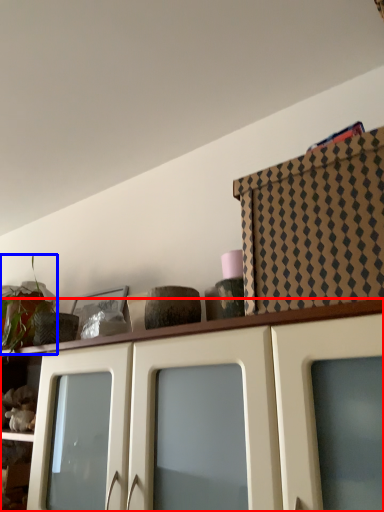
Question: Among these objects, which one is farthest to the camera, cabinetry (highlighted by a red box) or plant (highlighted by a blue box)?

Choices:
 (A) cabinetry
 (B) plant

Answer: (B)